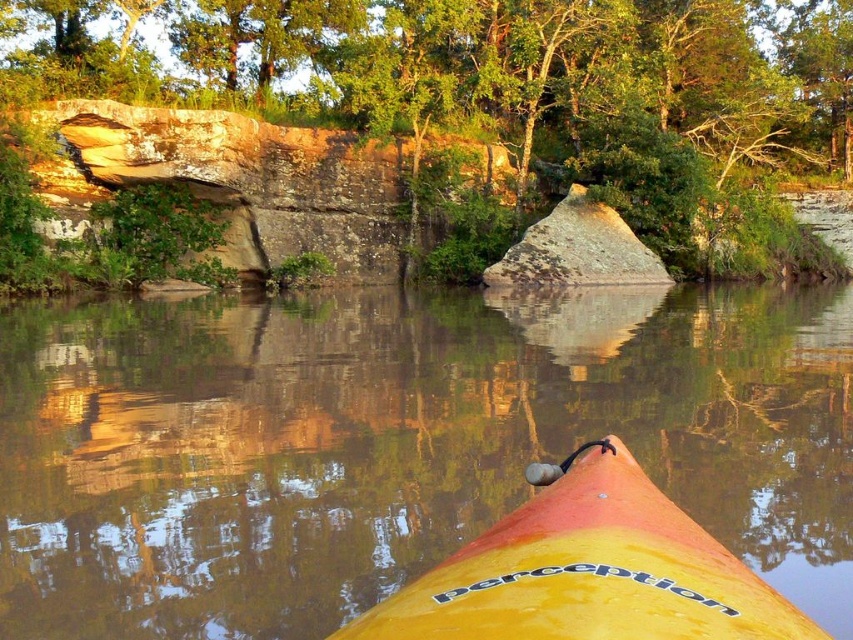
From the picture: You are standing on the riverbank and see two points marked in the image. Which point, point (x=642, y=358) or point (x=727, y=77), is closer to you?

Point (x=642, y=358) is closer to the viewer than point (x=727, y=77).

You are standing at the riverside and see the brown reflective water at center and the green leafy tree at upper center. Which object appears taller in the scene?

The green leafy tree at upper center appears taller than the brown reflective water at center.

You are a hiker standing at the edge of the river. You see a green leafy tree at upper center and a yellow matte kayak at center. Which object is positioned higher in the scene?

The green leafy tree at upper center is positioned higher than the yellow matte kayak at center.